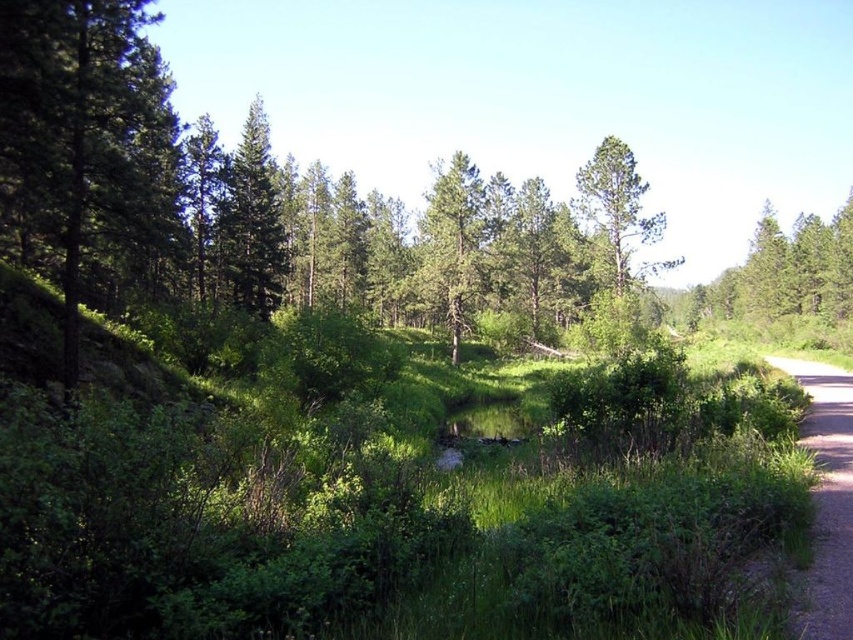
In the scene shown: You are standing at the point labeled point (846,472) and want to walk to the point labeled point (462,308) along the dirt path. Which direction should you face to start walking towards it?

You should face towards the left because point (462,308) is further away from the camera compared to point (846,472), meaning it is located to the left in the scene.

You are a hiker standing on the dirt path and want to take a photo of both the green matte tree at left and the green matte tree at upper left. Which tree should you move towards if you want to include both in your frame without zooming in?

You should move towards the green matte tree at upper left because the green matte tree at left is positioned on the right side of it, so positioning yourself closer to the upper left tree will allow both trees to be captured in the frame without zooming.